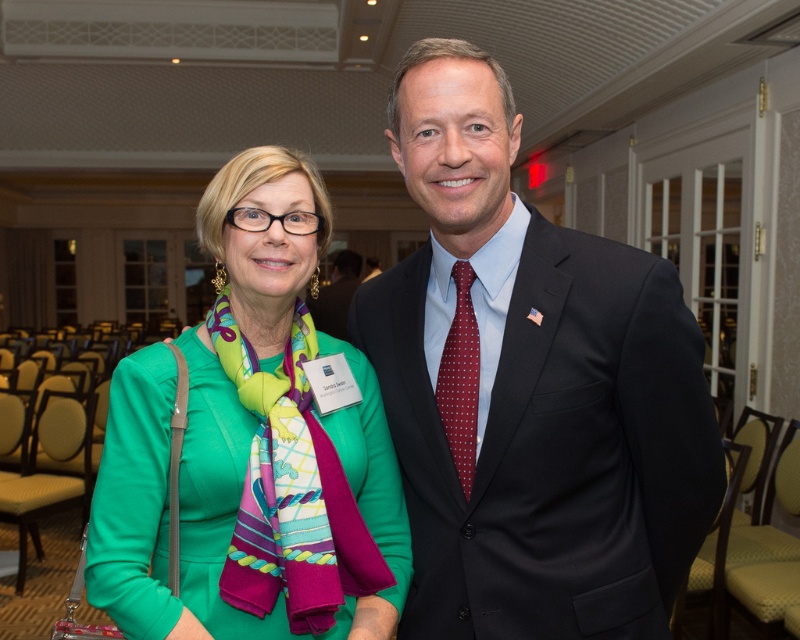
Question: Which point is closer to the camera?

Choices:
 (A) (232, 568)
 (B) (694, 422)

Answer: (A)

Question: Where is green silk scarf at center located in relation to red dotted tie at center in the image?

Choices:
 (A) above
 (B) below

Answer: (B)

Question: Is dark blue suit at center positioned behind red dotted tie at center?

Choices:
 (A) no
 (B) yes

Answer: (A)

Question: Among these points, which one is nearest to the camera?

Choices:
 (A) (344, 275)
 (B) (102, 467)
 (C) (472, 392)

Answer: (B)

Question: Which of these objects is positioned closest to the red dotted tie at center?

Choices:
 (A) green silk scarf at center
 (B) dark suit at center

Answer: (A)

Question: Is green silk scarf at center to the right of dark suit at center from the viewer's perspective?

Choices:
 (A) no
 (B) yes

Answer: (B)